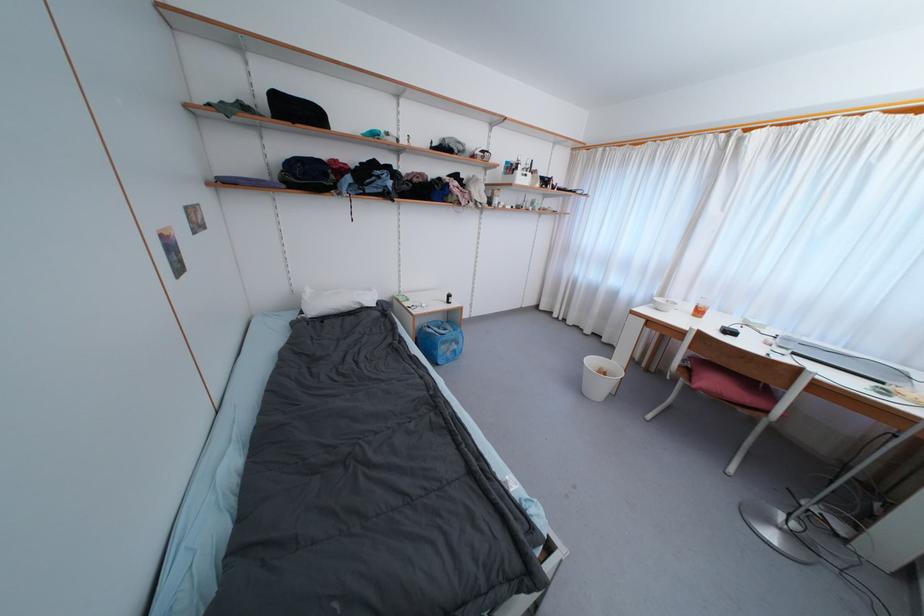
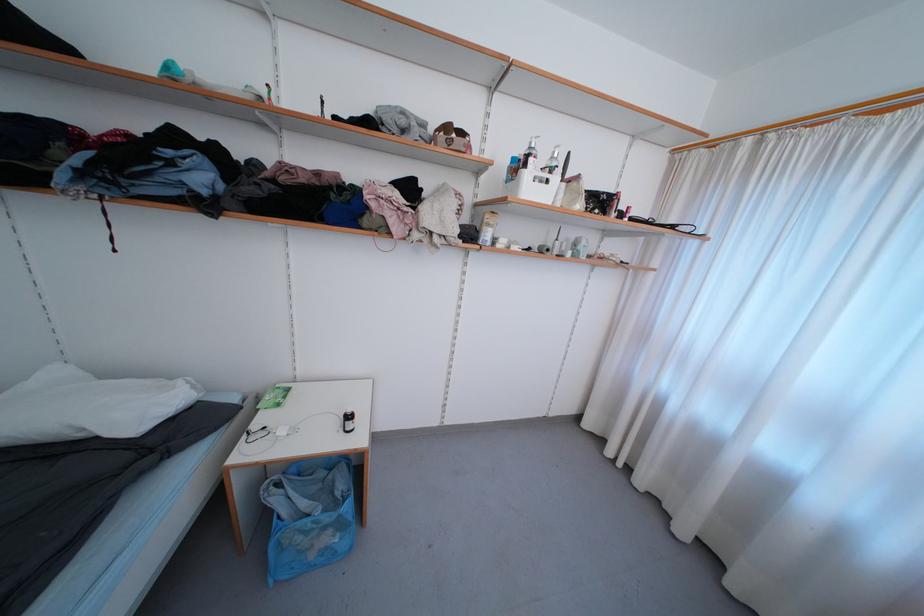
What movement of the cameraman would produce the second image?

The cameraman walked toward right, forward.